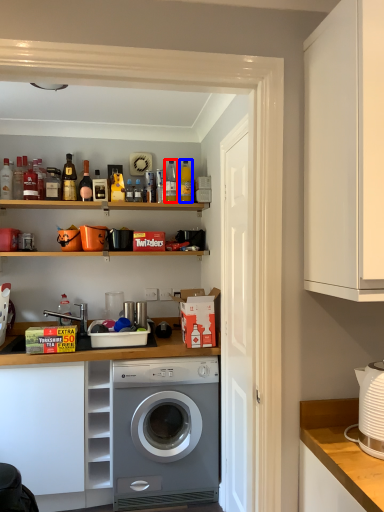
Question: Which point is further to the camera, bottle (highlighted by a red box) or bottle (highlighted by a blue box)?

Choices:
 (A) bottle
 (B) bottle

Answer: (A)